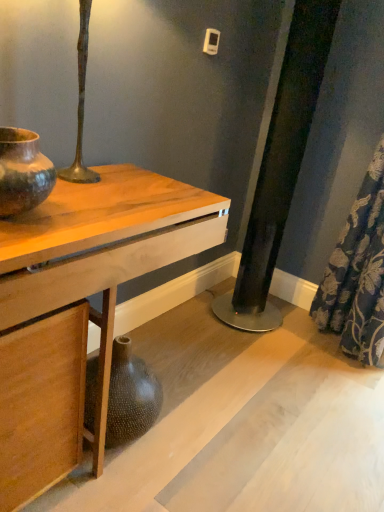
Find the location of a particular element. Image resolution: width=384 pixels, height=512 pixels. vacant space behind matte brown ceramic vase at left is located at coordinates (72, 196).